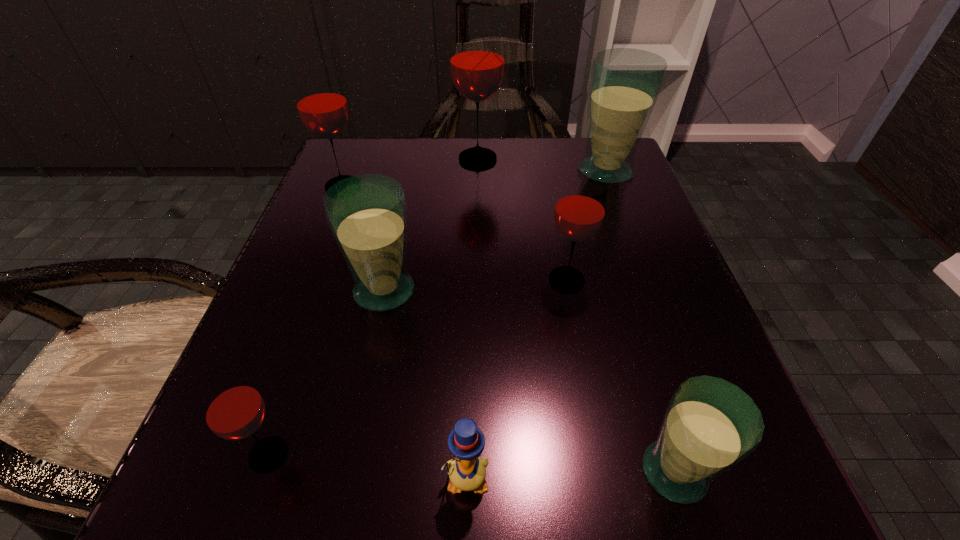
You are a GUI agent. You are given a task and a screenshot of the screen. Output one action in this format:
    pyautogui.click(x=<x>, y=<y>)
    Task: Click on the farthest red glass
    
    Given the screenshot: What is the action you would take?
    pyautogui.click(x=477, y=55)

At what (x,y) coordinates should I click in order to perform the action: click on the fourth glass from left to right. Please return your answer as a coordinate pair (x, y). This screenshot has height=540, width=960. Looking at the image, I should click on (477, 55).

This screenshot has height=540, width=960. I want to click on the second farthest red glass, so click(x=320, y=99).

This screenshot has height=540, width=960. What are the coordinates of `the farthest blue glass` in the screenshot? It's located at (624, 85).

I want to click on the rightmost red glass, so click(579, 213).

I want to click on the third object from right to left, so click(579, 213).

The height and width of the screenshot is (540, 960). What are the coordinates of `the sixth object from right to left` in the screenshot? It's located at (367, 214).

At what (x,y) coordinates should I click in order to perform the action: click on the second nearest blue glass. Please return your answer as a coordinate pair (x, y). This screenshot has height=540, width=960. Looking at the image, I should click on (367, 214).

The width and height of the screenshot is (960, 540). Identify the location of the nearest red glass. (233, 409).

Image resolution: width=960 pixels, height=540 pixels. In order to click on the smallest blue glass in this screenshot , I will do `click(710, 425)`.